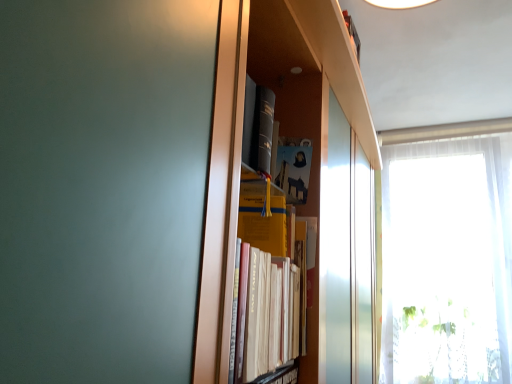
Question: Does white sheer curtain at right have a greater width compared to yellow matte paper at center, the 2th paperback book from the bottom?

Choices:
 (A) yes
 (B) no

Answer: (A)

Question: Considering the relative sizes of white sheer curtain at right and yellow matte paper at center, the 1th paperback book positioned from the top, in the image provided, is white sheer curtain at right taller than yellow matte paper at center, the 1th paperback book positioned from the top,?

Choices:
 (A) yes
 (B) no

Answer: (A)

Question: Is white sheer curtain at right facing towards yellow matte paper at center, the 1th paperback book positioned from the top?

Choices:
 (A) no
 (B) yes

Answer: (B)

Question: From the image's perspective, is white sheer curtain at right below yellow matte paper at center, the 1th paperback book positioned from the top?

Choices:
 (A) no
 (B) yes

Answer: (B)

Question: From a real-world perspective, is white sheer curtain at right on yellow matte paper at center, the 2th paperback book from the bottom?

Choices:
 (A) yes
 (B) no

Answer: (B)

Question: From the image's perspective, is yellow matte paper at center, the 1th paperback book positioned from the top, positioned above or below white sheer curtain at right?

Choices:
 (A) below
 (B) above

Answer: (B)

Question: Do you think yellow matte paper at center, the 1th paperback book positioned from the top, is within white sheer curtain at right, or outside of it?

Choices:
 (A) inside
 (B) outside

Answer: (B)

Question: Looking at their shapes, would you say yellow matte paper at center, the 1th paperback book positioned from the top, is wider or thinner than white sheer curtain at right?

Choices:
 (A) thin
 (B) wide

Answer: (A)

Question: Relative to white sheer curtain at right, is yellow matte paper at center, the 2th paperback book from the bottom, in front or behind?

Choices:
 (A) behind
 (B) front

Answer: (B)

Question: Looking at their shapes, would you say white sheer curtain at right is wider or thinner than yellow matte paper at center, the 1th paperback book positioned from the top?

Choices:
 (A) wide
 (B) thin

Answer: (A)

Question: Is point (420, 177) positioned closer to the camera than point (303, 155)?

Choices:
 (A) closer
 (B) farther

Answer: (B)

Question: From a real-world perspective, is white sheer curtain at right above or below yellow matte paper at center, the 2th paperback book from the bottom?

Choices:
 (A) above
 (B) below

Answer: (B)

Question: Do you think white sheer curtain at right is within yellow matte paper at center, the 1th paperback book positioned from the top, or outside of it?

Choices:
 (A) outside
 (B) inside

Answer: (A)

Question: Visually, is white sheer curtain at right positioned to the left or to the right of yellow paper at center, acting as the 2th paperback book starting from the top?

Choices:
 (A) right
 (B) left

Answer: (A)

Question: In the image, is white sheer curtain at right positioned in front of or behind yellow paper at center, which appears as the 1th paperback book when ordered from the bottom?

Choices:
 (A) behind
 (B) front

Answer: (A)